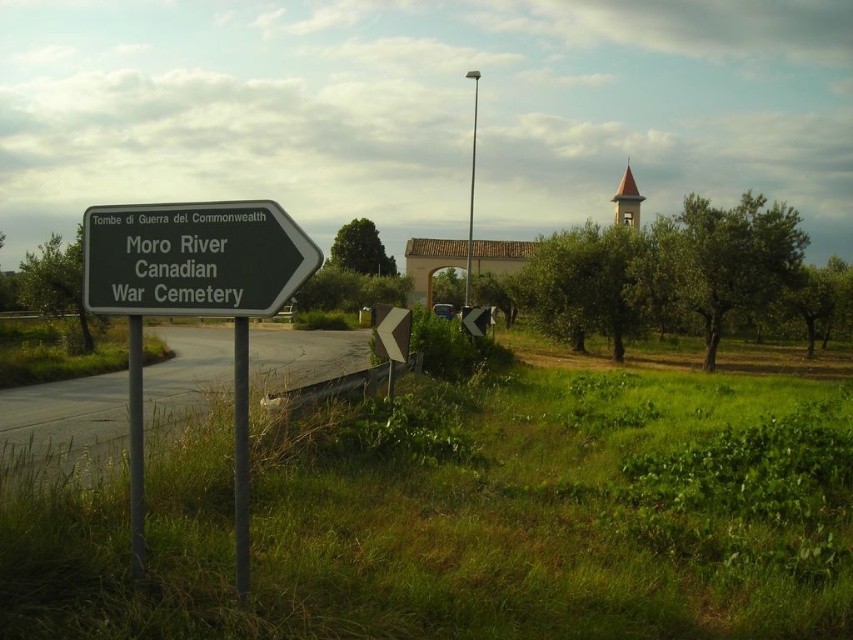
Question: Does green metallic sign at left have a larger size compared to black metal sign at left?

Choices:
 (A) no
 (B) yes

Answer: (B)

Question: Can you confirm if green metallic sign at left is positioned to the left of black metal sign at left?

Choices:
 (A) no
 (B) yes

Answer: (B)

Question: Among these points, which one is farthest from the camera?

Choices:
 (A) (218, 208)
 (B) (195, 234)

Answer: (B)

Question: Is green metallic sign at left closer to camera compared to black metal sign at left?

Choices:
 (A) no
 (B) yes

Answer: (A)